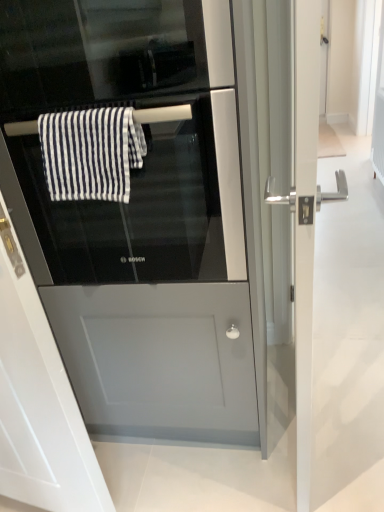
Question: In the image, is white striped fabric at center on the left side or the right side of black glass screen door at center, arranged as the 1th screen door when viewed from the left?

Choices:
 (A) right
 (B) left

Answer: (A)

Question: Does point (117, 173) appear closer or farther from the camera than point (0, 439)?

Choices:
 (A) farther
 (B) closer

Answer: (B)

Question: Considering the real-world distances, which object is farthest from the white striped fabric at center?

Choices:
 (A) silver metallic door handle at right, positioned as the 1th screen door in right-to-left order
 (B) satin silver fridge at center
 (C) black glass oven at center
 (D) black glass screen door at center, arranged as the 1th screen door when viewed from the left

Answer: (A)

Question: Considering the real-world distances, which object is closest to the black glass screen door at center, placed as the second screen door when sorted from right to left?

Choices:
 (A) silver metallic door handle at right, positioned as the 1th screen door in right-to-left order
 (B) white striped fabric at center
 (C) black glass oven at center
 (D) satin silver fridge at center

Answer: (D)